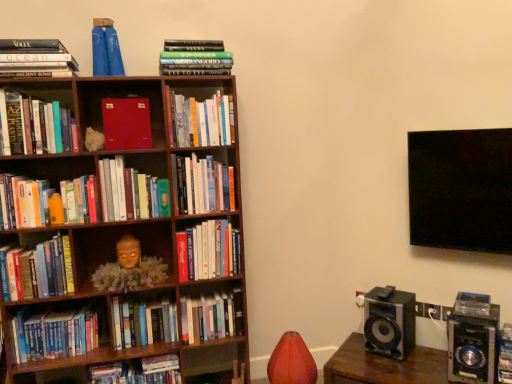
This screenshot has height=384, width=512. Find the location of `vacant area on top of wooden speaker at lower right (from a real-world perspective)`. vacant area on top of wooden speaker at lower right (from a real-world perspective) is located at coordinates (395, 361).